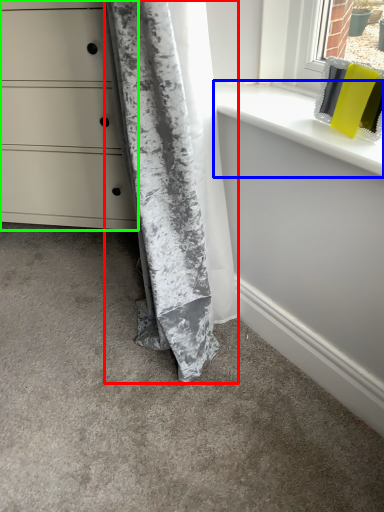
Question: Considering the real-world distances, which object is farthest from curtain (highlighted by a red box)? window sill (highlighted by a blue box) or chest of drawers (highlighted by a green box)?

Choices:
 (A) window sill
 (B) chest of drawers

Answer: (B)